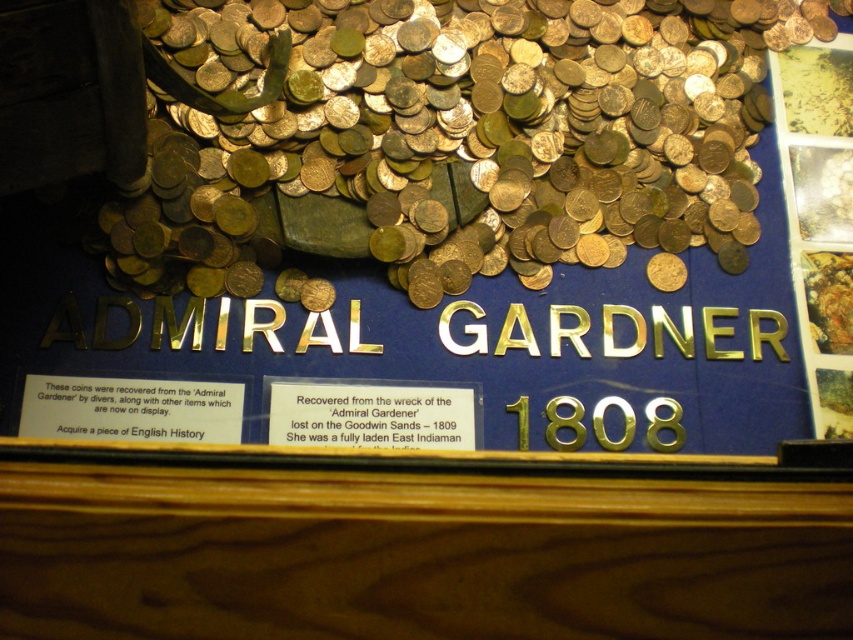
Between point (227, 259) and point (276, 397), which one is positioned behind?

The point (227, 259) is more distant.

Is point (592, 141) in front of point (433, 426)?

No, (592, 141) is further to viewer.

Who is more distant from viewer, [402,99] or [361,424]?

The point [402,99] is behind.

Identify the location of gold shiny coins at upper center. (474, 124).

Is gold shiny coins at upper center further to the viewer compared to matte gold plaque at lower left?

No, gold shiny coins at upper center is in front of matte gold plaque at lower left.

This screenshot has height=640, width=853. What are the coordinates of `gold shiny coins at upper center` in the screenshot? It's located at (474, 124).

Identify the location of gold shiny coins at upper center. This screenshot has height=640, width=853. (474, 124).

Find the location of a particular element. gold shiny coins at upper center is located at coordinates (474, 124).

Does matte gold plaque at lower left lie behind gold metallic plaque at center?

No, it is not.

The height and width of the screenshot is (640, 853). Describe the element at coordinates (131, 410) in the screenshot. I see `matte gold plaque at lower left` at that location.

Who is more forward, (62, 385) or (393, 406)?

Positioned in front is point (62, 385).

This screenshot has height=640, width=853. What are the coordinates of `matte gold plaque at lower left` in the screenshot? It's located at (131, 410).